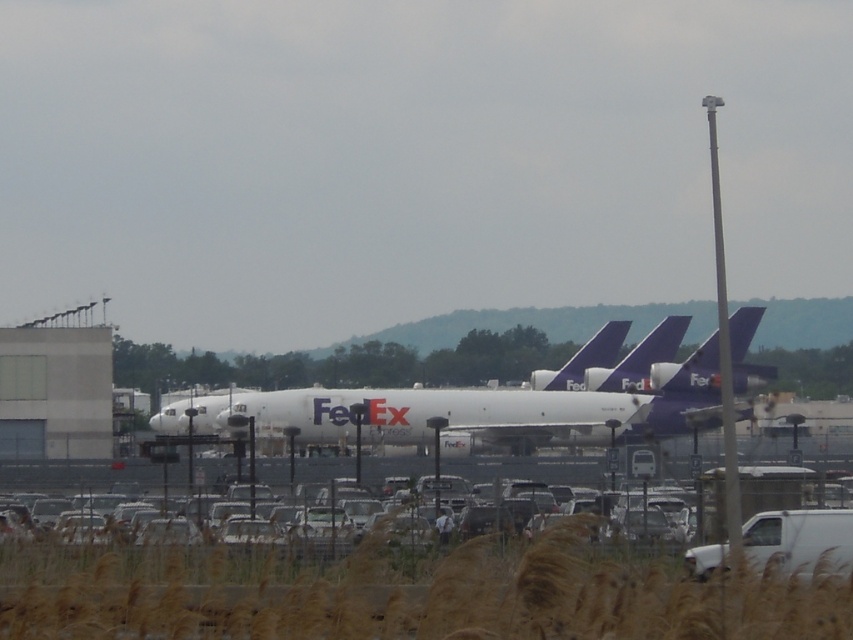
You are standing at the point with coordinates [473,410]. Based on the scene, what object are you standing on?

The point at coordinates [473,410] is on the white matte FedEx plane at center.

You are a photographer standing at the edge of the airport runway. You want to capture a photo of the white matte fedex plane at center and the white matte car at lower center in the same frame. Which object should you focus on first to ensure both are in the frame?

The white matte fedex plane at center is taller than the white matte car at lower center, so you should focus on the white matte fedex plane at center first to ensure both are in the frame.